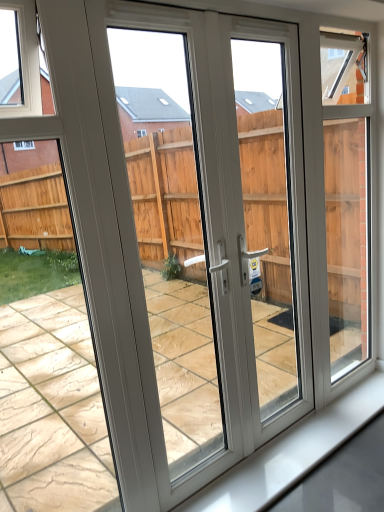
Question: Considering the positions of white plastic screen door at center, placed as the 2th screen door when sorted from left to right, and white glossy window sill at lower center in the image, is white plastic screen door at center, placed as the 2th screen door when sorted from left to right, taller or shorter than white glossy window sill at lower center?

Choices:
 (A) tall
 (B) short

Answer: (A)

Question: Is white plastic screen door at center, placed as the 2th screen door when sorted from left to right, to the left or to the right of white glossy window sill at lower center in the image?

Choices:
 (A) right
 (B) left

Answer: (B)

Question: Based on their relative distances, which object is nearer to the white plastic screen door at center, which is the second screen door in right-to-left order?

Choices:
 (A) white glossy window sill at lower center
 (B) white plastic screen door at center, placed as the 2th screen door when sorted from left to right

Answer: (B)

Question: Which object is the closest to the white plastic screen door at center, which is the second screen door in right-to-left order?

Choices:
 (A) white plastic screen door at center, placed as the 2th screen door when sorted from left to right
 (B) white glossy window sill at lower center

Answer: (A)